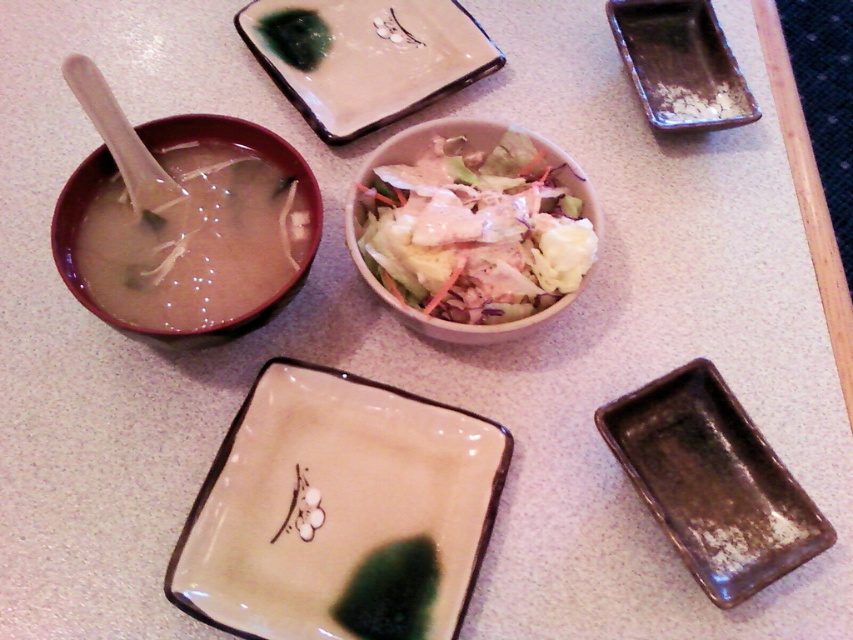
Question: Can you confirm if brown glazed tray at lower right is positioned above brown glazed tray at upper right?

Choices:
 (A) yes
 (B) no

Answer: (B)

Question: Which of the following is the closest to the observer?

Choices:
 (A) brown ceramic bowl at upper left
 (B) brown glazed tray at upper right
 (C) matte ceramic platter at center
 (D) white glossy platter at upper center

Answer: (C)

Question: Does brown glazed tray at lower right have a lesser width compared to white plastic spoon at upper left?

Choices:
 (A) yes
 (B) no

Answer: (B)

Question: Where is matte ceramic platter at center located in relation to brown ceramic bowl at upper left in the image?

Choices:
 (A) below
 (B) above

Answer: (A)

Question: Which point is farther from the camera taking this photo?

Choices:
 (A) (316, 13)
 (B) (380, 605)
 (C) (178, 333)
 (D) (444, 221)

Answer: (A)

Question: Which of the following is the closest to the observer?

Choices:
 (A) brown ceramic bowl at upper left
 (B) matte ceramic platter at center
 (C) white creamy salad at center

Answer: (B)